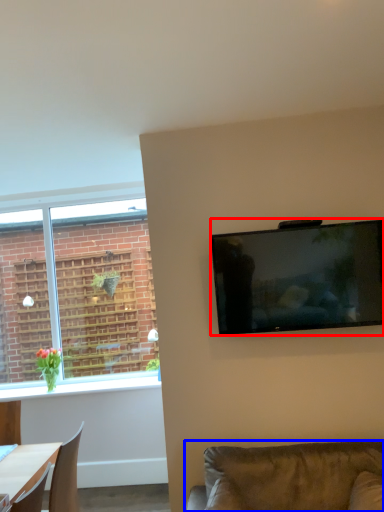
Question: Which object is closer to the camera taking this photo, television (highlighted by a red box) or studio couch (highlighted by a blue box)?

Choices:
 (A) television
 (B) studio couch

Answer: (B)